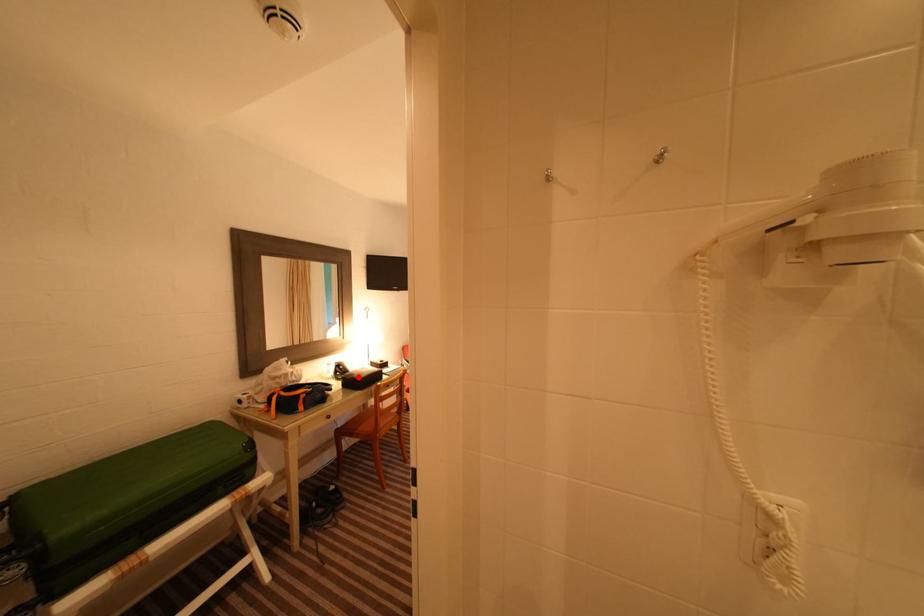
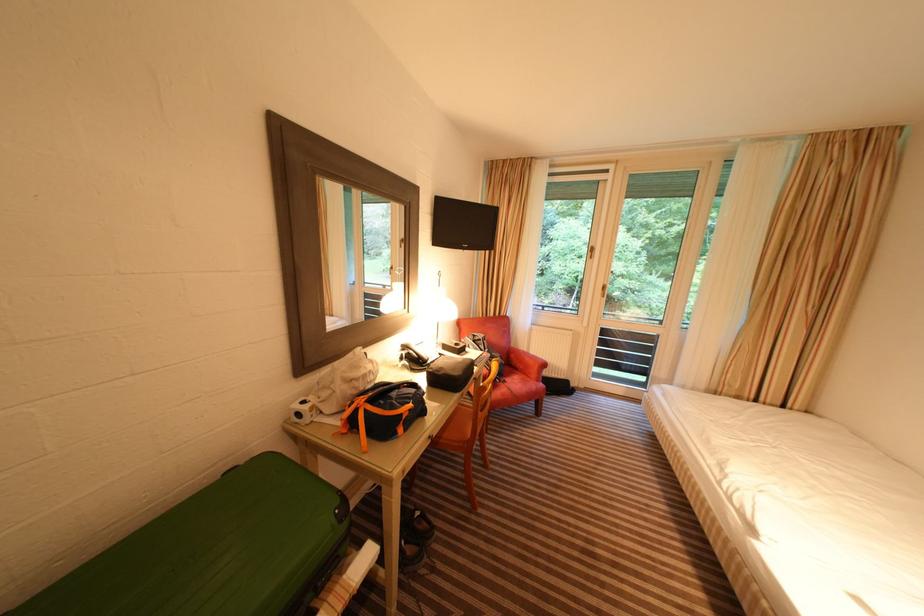
Question: I am providing you with two images of the same scene from different viewpoints. A red point is marked on the first image. Is the red point's position out of view in image 2?

Choices:
 (A) Yes
 (B) No

Answer: (B)